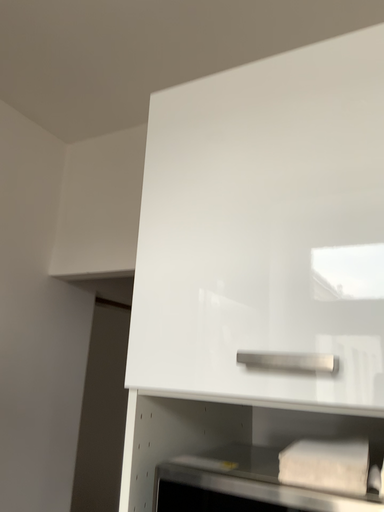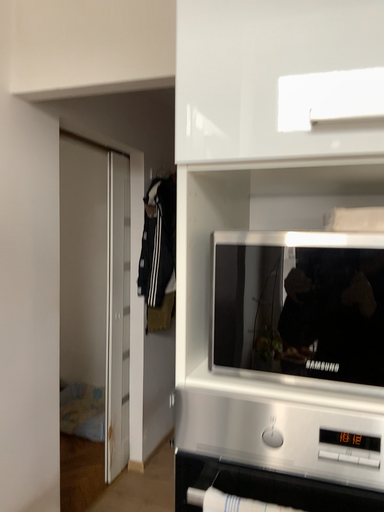
Question: How did the camera likely rotate when shooting the video?

Choices:
 (A) rotated left
 (B) rotated right

Answer: (B)